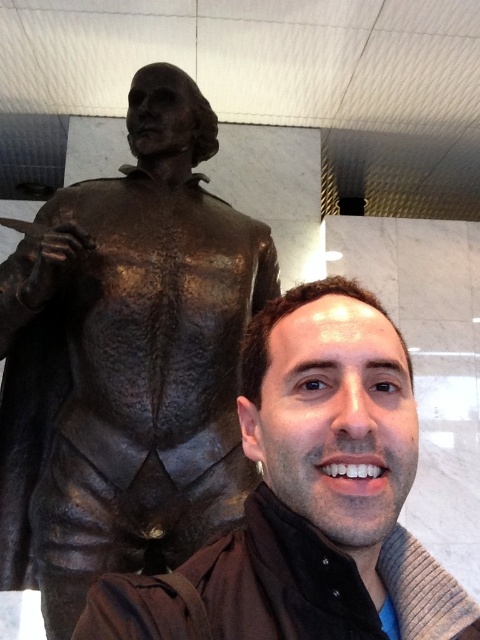
Does bronze statue at left appear under matte bronze statue at left?

No.

Who is lower down, bronze statue at left or matte bronze statue at left?

matte bronze statue at left is lower down.

Does point (132, 541) lie behind point (109, 611)?

That is True.

Where is `bronze statue at left`? The width and height of the screenshot is (480, 640). bronze statue at left is located at coordinates (127, 362).